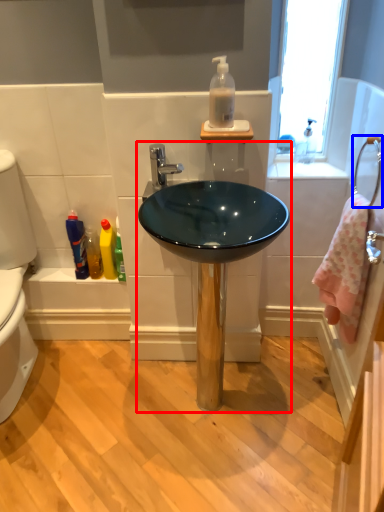
Question: Which object appears farthest to the camera in this image, sink (highlighted by a red box) or towel bar (highlighted by a blue box)?

Choices:
 (A) sink
 (B) towel bar

Answer: (A)